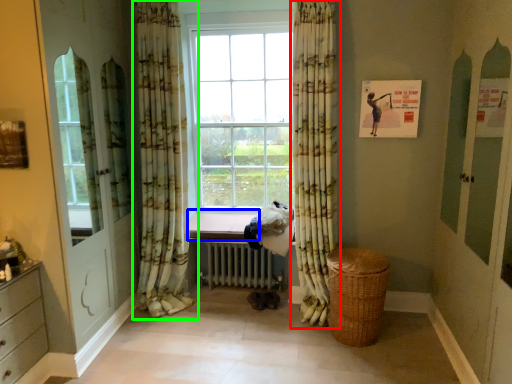
Question: Which is nearer to the curtain (highlighted by a red box)? window sill (highlighted by a blue box) or curtain (highlighted by a green box).

Choices:
 (A) window sill
 (B) curtain

Answer: (A)